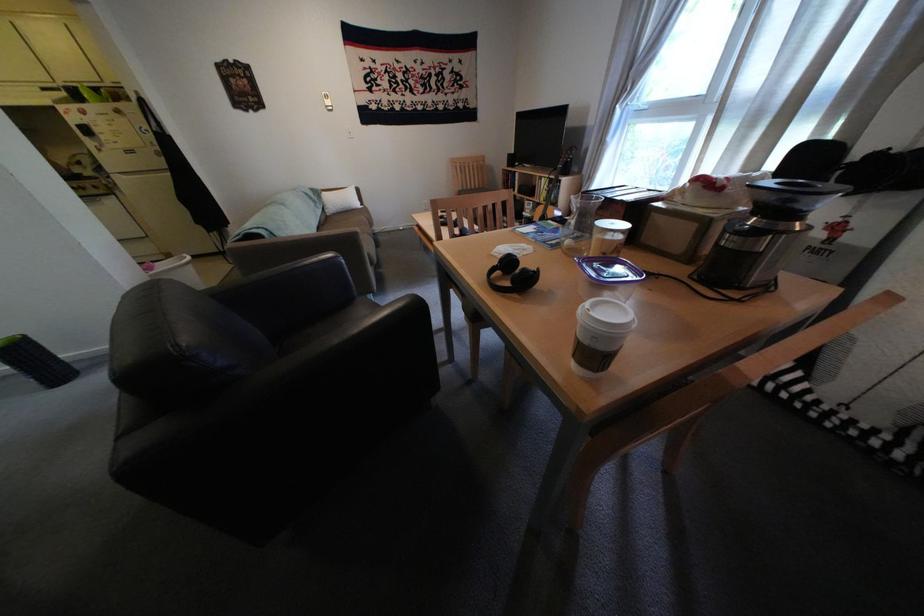
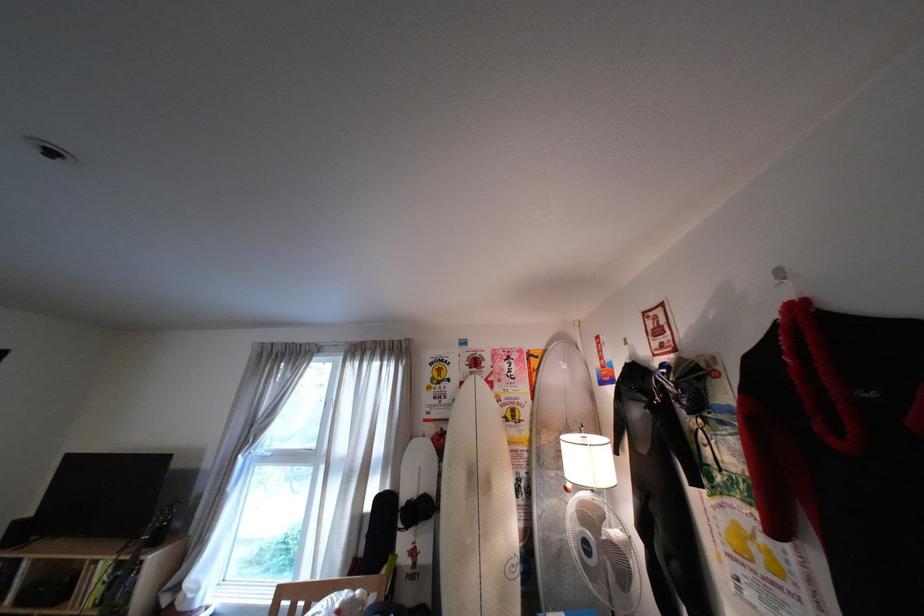
First-person continuous shooting, in which direction is the camera rotating?

The rotation direction of the camera is right-up.